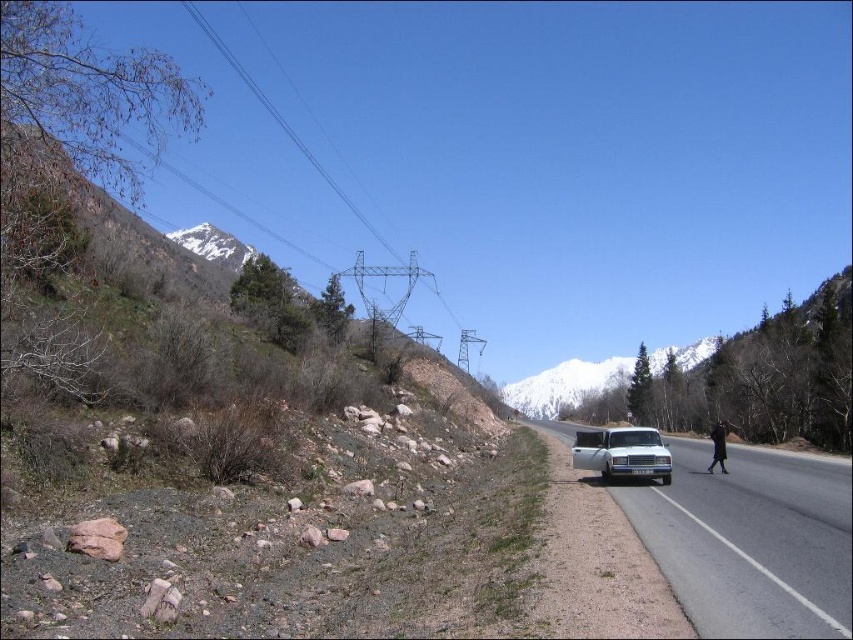
Who is higher up, white glossy car at center or white glossy sedan at center?

white glossy sedan at center

Is white glossy car at center above white glossy sedan at center?

No.

Is point (706, 605) positioned in front of point (604, 456)?

That is True.

The height and width of the screenshot is (640, 853). In order to click on white glossy car at center in this screenshot , I will do `click(749, 541)`.

Does point (447, 500) come farther from viewer compared to point (602, 444)?

Yes, point (447, 500) is behind point (602, 444).

Is rustic brown dirt at upper left thinner than white glossy sedan at center?

In fact, rustic brown dirt at upper left might be wider than white glossy sedan at center.

Image resolution: width=853 pixels, height=640 pixels. Describe the element at coordinates (231, 460) in the screenshot. I see `rustic brown dirt at upper left` at that location.

This screenshot has height=640, width=853. What are the coordinates of `rustic brown dirt at upper left` in the screenshot? It's located at (231, 460).

I want to click on white glossy sedan at center, so click(622, 452).

Does white glossy sedan at center have a greater width compared to metallic wire at upper center?

Incorrect, white glossy sedan at center's width does not surpass metallic wire at upper center's.

I want to click on white glossy sedan at center, so click(x=622, y=452).